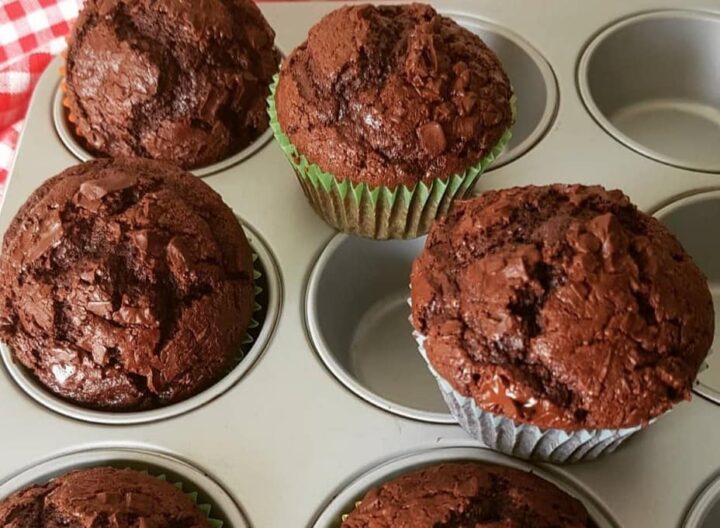
Where is `silver cups`? silver cups is located at coordinates (594, 103), (664, 150).